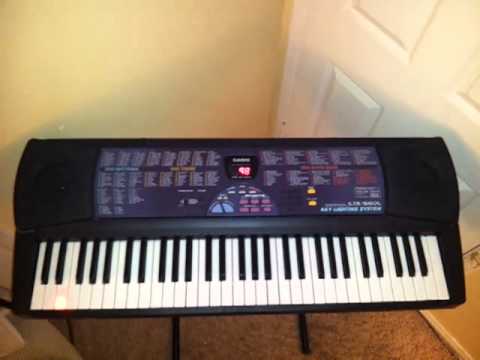
Image resolution: width=480 pixels, height=360 pixels. Find the location of `keyboard`. keyboard is located at coordinates (211, 250).